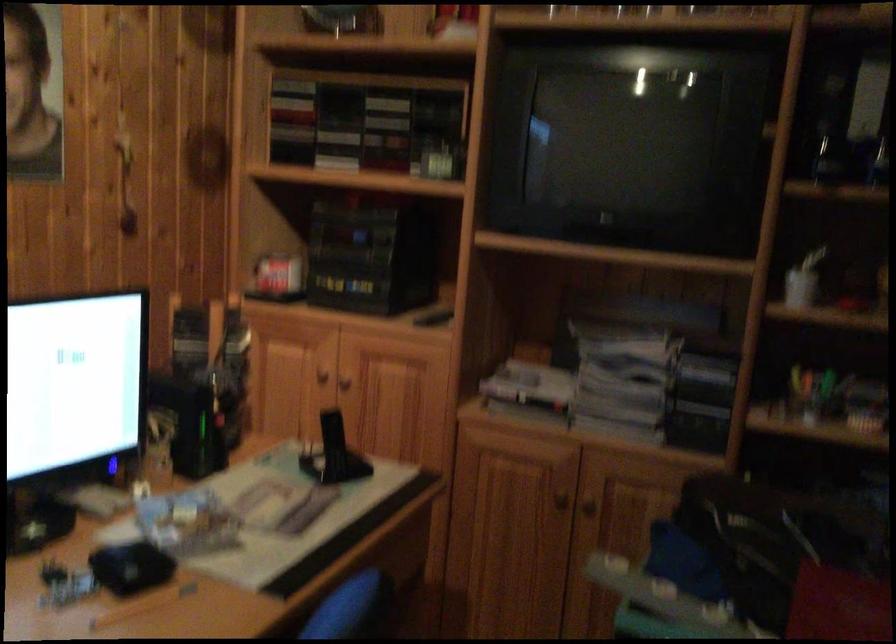
Question: The camera is either moving clockwise (left) or counter-clockwise (right) around the object. The first image is from the beginning of the video and the second image is from the end. Is the camera moving left or right when shooting the video?

Choices:
 (A) Left
 (B) Right

Answer: (A)